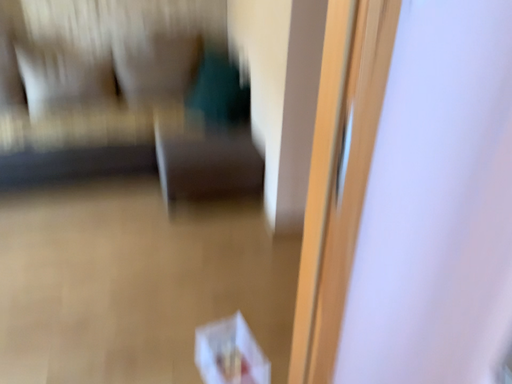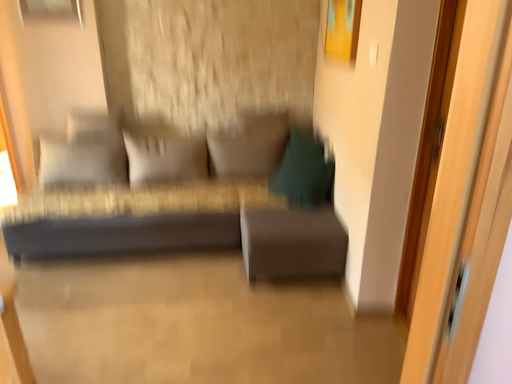
Question: Which way did the camera rotate in the video?

Choices:
 (A) rotated downward
 (B) rotated upward

Answer: (B)